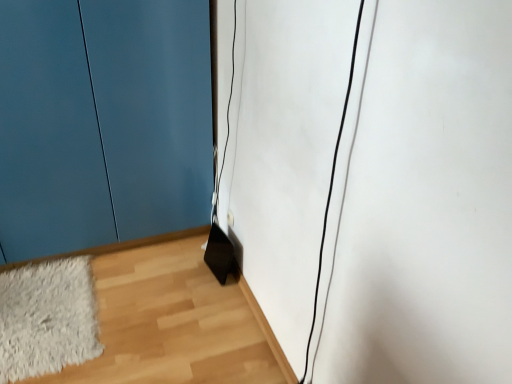
Question: Considering the positions of point (58, 316) and point (75, 145), is point (58, 316) closer or farther from the camera than point (75, 145)?

Choices:
 (A) farther
 (B) closer

Answer: (B)

Question: Considering the positions of white fluffy rug at lower left and matte blue door at lower left in the image, is white fluffy rug at lower left taller or shorter than matte blue door at lower left?

Choices:
 (A) short
 (B) tall

Answer: (A)

Question: Which object is the closest to the white fluffy rug at lower left?

Choices:
 (A) matte blue door at lower left
 (B) wooden floor at lower right

Answer: (B)

Question: Which object is positioned farthest from the white fluffy rug at lower left?

Choices:
 (A) matte blue door at lower left
 (B) wooden floor at lower right

Answer: (A)